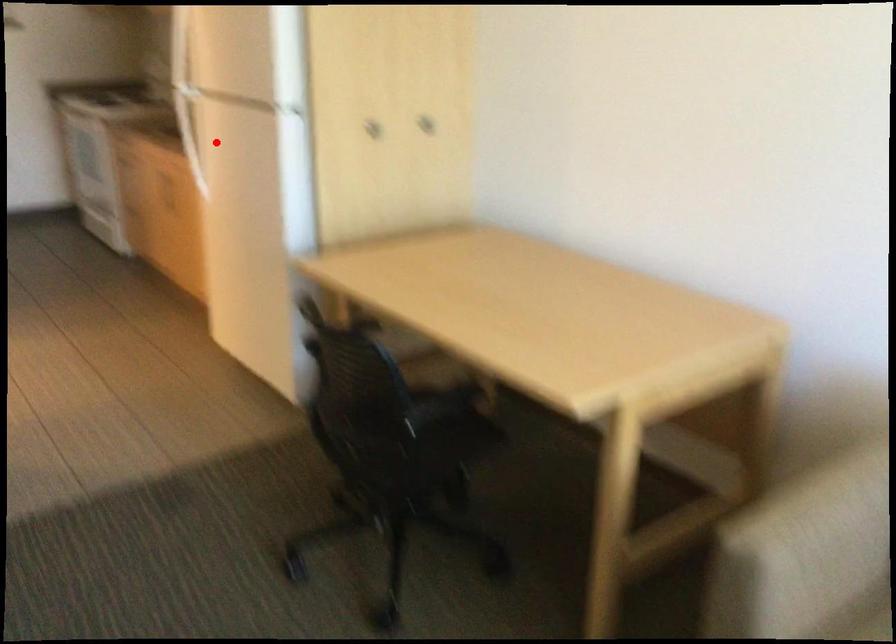
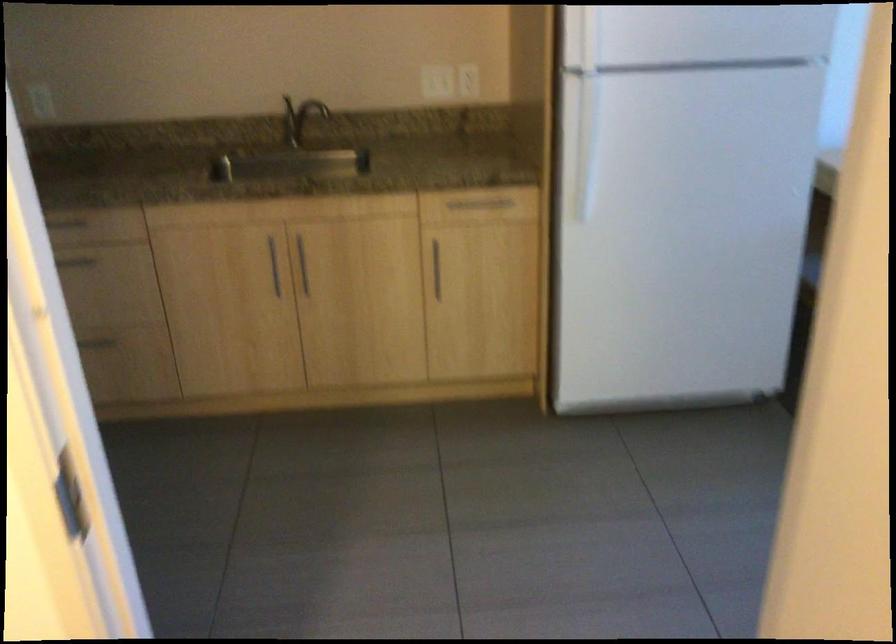
Question: I am providing you with two images of the same scene from different viewpoints. A red point is shown in image1. For the corresponding object point in image2, is it positioned nearer or farther from the camera?

Choices:
 (A) Nearer
 (B) Farther

Answer: (A)